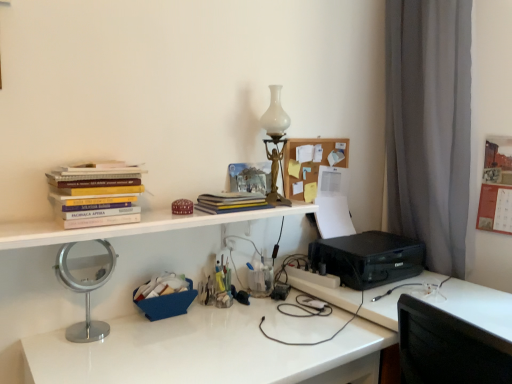
Question: Visually, is black plastic printer at lower right positioned to the left or to the right of blue fabric basket at center, arranged as the 1th stationery when ordered from the bottom?

Choices:
 (A) right
 (B) left

Answer: (A)

Question: Considering the positions of black plastic printer at lower right and blue fabric basket at center, the 3th stationery viewed from the top, in the image, is black plastic printer at lower right bigger or smaller than blue fabric basket at center, the 3th stationery viewed from the top,?

Choices:
 (A) small
 (B) big

Answer: (B)

Question: Estimate the real-world distances between objects in this image. Which object is farther from the white glass table lamp at upper center?

Choices:
 (A) wooden corkboard at upper center
 (B) hardcover books at upper left, marked as the 1th book in a front-to-back arrangement
 (C) yellow matte book at center, which appears as the 2th book when viewed from the front
 (D) matte red box at upper center, marked as the 3th stationery in a bottom-to-top arrangement
 (E) white glossy desk at center

Answer: (B)

Question: Which is nearer to the wooden corkboard at upper center?

Choices:
 (A) black plastic printer at lower right
 (B) white glass table lamp at upper center
 (C) black plastic printer at lower right
 (D) blue fabric basket at center, the 3th stationery viewed from the top
 (E) matte red box at upper center, the first stationery when ordered from top to bottom

Answer: (B)